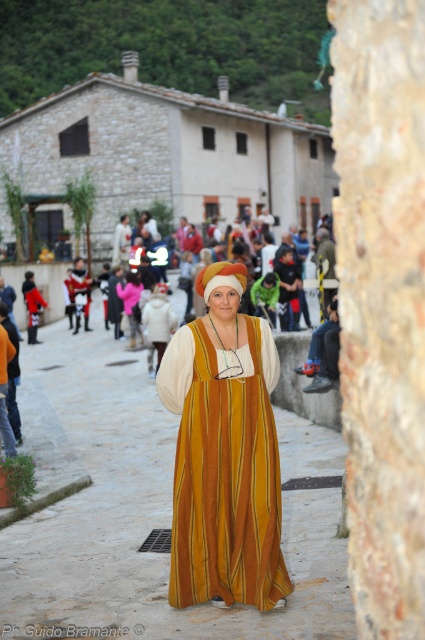
Question: Does striped fabric dress at center have a larger size compared to white fabric mask at center?

Choices:
 (A) yes
 (B) no

Answer: (A)

Question: Estimate the real-world distances between objects in this image. Which object is farther from the velvet yellow dress at center?

Choices:
 (A) velvet red cape at center
 (B) striped fabric dress at center
 (C) pink fabric dress at center

Answer: (A)

Question: Considering the real-world distances, which object is closest to the striped fabric dress at center?

Choices:
 (A) pink fabric dress at center
 (B) yellow striped dress at center
 (C) velvet yellow dress at center

Answer: (C)

Question: In this image, where is striped fabric dress at center located relative to velvet yellow dress at center?

Choices:
 (A) below
 (B) above

Answer: (A)

Question: In this image, where is yellow striped dress at center located relative to pink fabric dress at center?

Choices:
 (A) below
 (B) above

Answer: (B)

Question: Which point appears closest to the camera in this image?

Choices:
 (A) (130, 278)
 (B) (78, 298)
 (C) (231, 568)

Answer: (C)